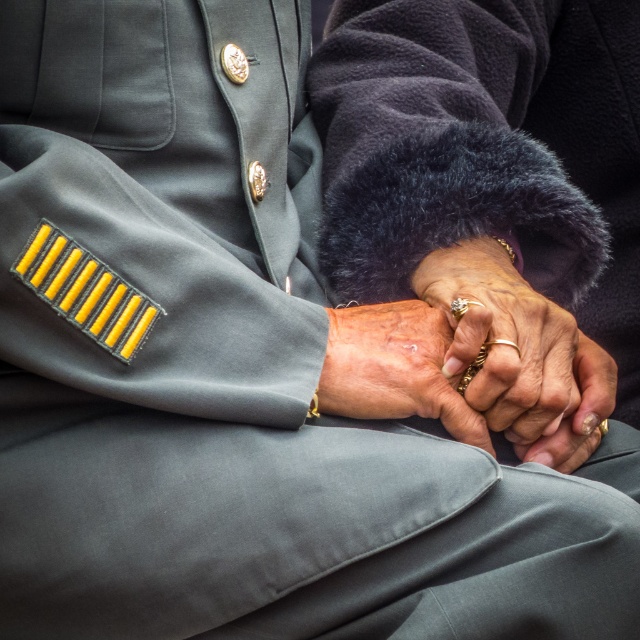
Question: Which point is farther from the camera taking this photo?

Choices:
 (A) (502, 380)
 (B) (392, 344)

Answer: (B)

Question: Is gold textured ring at center bigger than dry skin at center?

Choices:
 (A) yes
 (B) no

Answer: (A)

Question: Is gold textured ring at center positioned before dry skin at center?

Choices:
 (A) yes
 (B) no

Answer: (B)

Question: Is gold textured ring at center wider than dry skin at center?

Choices:
 (A) no
 (B) yes

Answer: (B)

Question: Which object is farther from the camera taking this photo?

Choices:
 (A) dry skin at center
 (B) gold textured ring at center

Answer: (B)